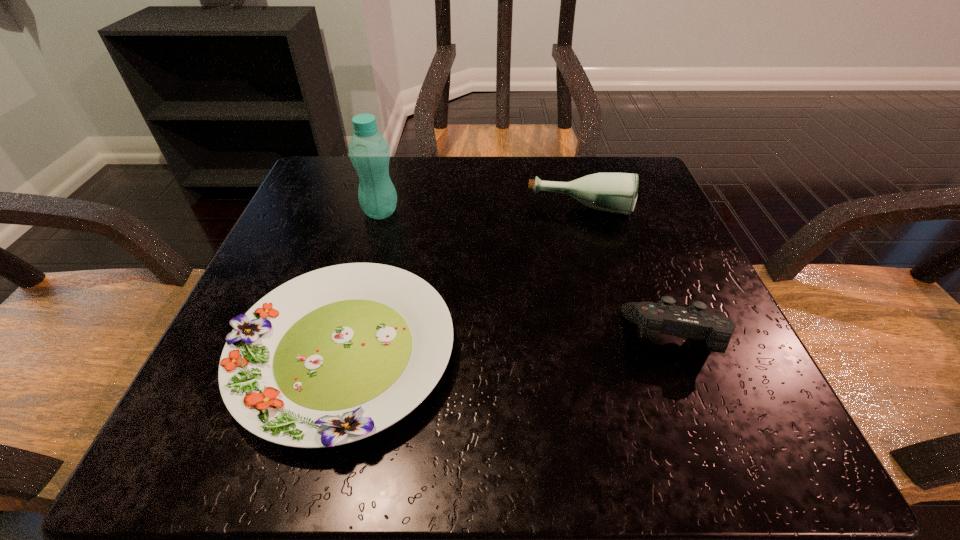
At what (x,y) coordinates should I click in order to perform the action: click on the left bottle. Please return your answer as a coordinate pair (x, y). Looking at the image, I should click on (369, 152).

You are a GUI agent. You are given a task and a screenshot of the screen. Output one action in this format:
    pyautogui.click(x=<x>, y=<y>)
    Task: Click on the tallest object
    
    Given the screenshot: What is the action you would take?
    pyautogui.click(x=369, y=152)

I want to click on the shorter bottle, so click(x=612, y=192).

At what (x,y) coordinates should I click in order to perform the action: click on control. Please return your answer as a coordinate pair (x, y). This screenshot has height=540, width=960. Looking at the image, I should click on [x=694, y=322].

This screenshot has width=960, height=540. I want to click on the shortest object, so click(x=335, y=355).

The width and height of the screenshot is (960, 540). Find the location of `free space located 0.330m on the front of the left bottle`. free space located 0.330m on the front of the left bottle is located at coordinates (337, 369).

At what (x,y) coordinates should I click in order to perform the action: click on blank area located on the back of the right bottle. Please return your answer as a coordinate pair (x, y). The height and width of the screenshot is (540, 960). Looking at the image, I should click on (569, 171).

At what (x,y) coordinates should I click in order to perform the action: click on vacant region located 0.340m on the back of the control. Please return your answer as a coordinate pair (x, y). This screenshot has height=540, width=960. Looking at the image, I should click on (616, 188).

Locate an element on the screen. The height and width of the screenshot is (540, 960). free spot located on the back of the shortest object is located at coordinates (393, 173).

Find the location of a particular element. object located in the near edge section of the desktop is located at coordinates (335, 355).